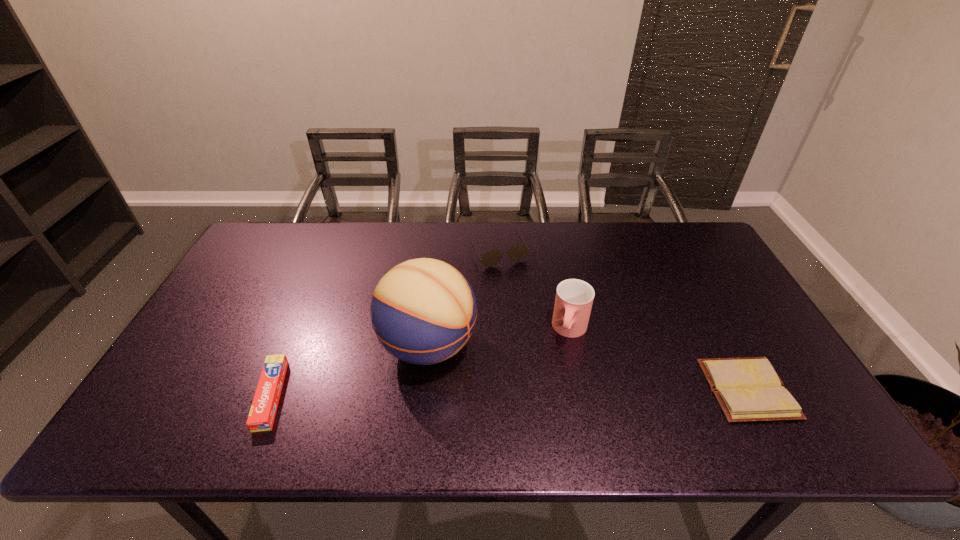
Where is `free space at the near left corner`? free space at the near left corner is located at coordinates (159, 400).

I want to click on empty location between the second shortest object and the tallest object, so click(x=349, y=370).

Where is `empty space that is in between the fourth shortest object and the basketball`? The width and height of the screenshot is (960, 540). empty space that is in between the fourth shortest object and the basketball is located at coordinates (499, 338).

The image size is (960, 540). What are the coordinates of `empty space that is in between the leftmost object and the rightmost object` in the screenshot? It's located at (510, 392).

Image resolution: width=960 pixels, height=540 pixels. I want to click on vacant space that's between the tallest object and the leftmost object, so click(x=349, y=370).

Find the location of `free space between the shortest object and the third tallest object`. free space between the shortest object and the third tallest object is located at coordinates (623, 321).

This screenshot has width=960, height=540. Identify the location of object that stands as the second closest to the shortest object. (518, 252).

Where is `object that stands as the third closest to the farthest object`? The height and width of the screenshot is (540, 960). object that stands as the third closest to the farthest object is located at coordinates (748, 389).

You are a GUI agent. You are given a task and a screenshot of the screen. Output one action in this format:
    pyautogui.click(x=<x>, y=<y>)
    Task: Click on the free spot that satisfies the following two spatial constraints: 1. on the front side of the shortest object; 2. on the left side of the basketball
    
    Given the screenshot: What is the action you would take?
    pyautogui.click(x=423, y=389)

Where is `free space in the image that satisfies the following two spatial constraints: 1. on the back side of the rightmost object; 2. on the right side of the toothpaste`? free space in the image that satisfies the following two spatial constraints: 1. on the back side of the rightmost object; 2. on the right side of the toothpaste is located at coordinates coord(274,389).